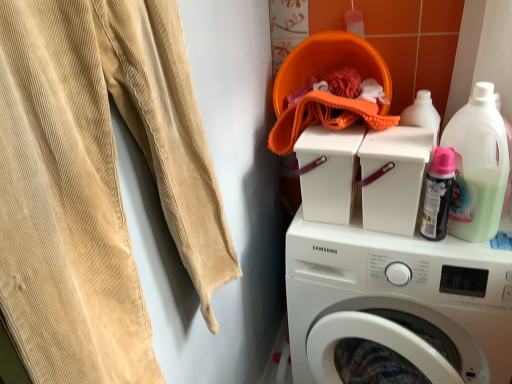
Question: Is translucent plastic detergent at upper right located outside beige corduroy sweat pants at left?

Choices:
 (A) no
 (B) yes

Answer: (B)

Question: From the image's perspective, does translucent plastic detergent at upper right appear higher than beige corduroy sweat pants at left?

Choices:
 (A) no
 (B) yes

Answer: (B)

Question: Considering the relative positions of translucent plastic detergent at upper right and beige corduroy sweat pants at left in the image provided, is translucent plastic detergent at upper right to the left of beige corduroy sweat pants at left from the viewer's perspective?

Choices:
 (A) yes
 (B) no

Answer: (B)

Question: Could you tell me if translucent plastic detergent at upper right is turned towards beige corduroy sweat pants at left?

Choices:
 (A) yes
 (B) no

Answer: (B)

Question: Considering the relative positions of translucent plastic detergent at upper right and beige corduroy sweat pants at left in the image provided, is translucent plastic detergent at upper right behind beige corduroy sweat pants at left?

Choices:
 (A) no
 (B) yes

Answer: (B)

Question: Is translucent plastic detergent at upper right looking in the opposite direction of beige corduroy sweat pants at left?

Choices:
 (A) no
 (B) yes

Answer: (A)

Question: Would you say beige corduroy sweat pants at left contains white plastic container at center?

Choices:
 (A) yes
 (B) no

Answer: (B)

Question: From the image's perspective, would you say beige corduroy sweat pants at left is positioned over white plastic container at center?

Choices:
 (A) yes
 (B) no

Answer: (B)

Question: Is beige corduroy sweat pants at left next to white plastic container at center and touching it?

Choices:
 (A) yes
 (B) no

Answer: (B)

Question: Considering the relative positions of beige corduroy sweat pants at left and white plastic container at center in the image provided, is beige corduroy sweat pants at left behind white plastic container at center?

Choices:
 (A) no
 (B) yes

Answer: (A)

Question: From the image's perspective, would you say beige corduroy sweat pants at left is shown under white plastic container at center?

Choices:
 (A) yes
 (B) no

Answer: (A)

Question: Is beige corduroy sweat pants at left turned away from white plastic container at center?

Choices:
 (A) no
 (B) yes

Answer: (A)

Question: Can you confirm if white plastic container at center is shorter than translucent plastic detergent at upper right?

Choices:
 (A) yes
 (B) no

Answer: (A)